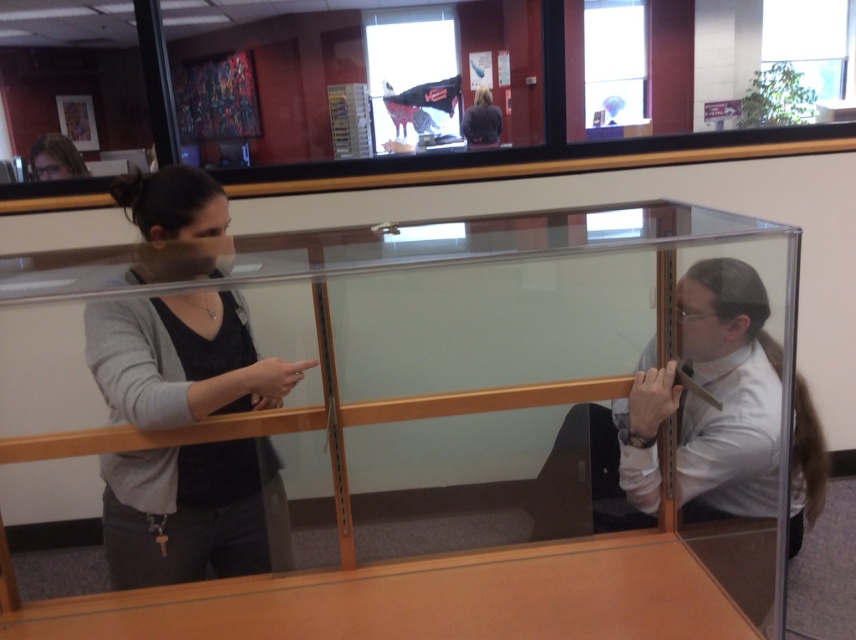
Does transparent glass box at center come in front of dark gray sweater at left?

Yes.

Which is below, transparent glass box at center or dark gray sweater at left?

Positioned lower is transparent glass box at center.

Does point (464, 413) come in front of point (254, 516)?

Yes, it is in front of point (254, 516).

You are a GUI agent. You are given a task and a screenshot of the screen. Output one action in this format:
    pyautogui.click(x=<x>, y=<y>)
    Task: Click on the transparent glass box at center
    This screenshot has height=640, width=856.
    Given the screenshot: What is the action you would take?
    pyautogui.click(x=421, y=384)

Is transparent glass box at center shorter than dark brown hair at upper center?

No.

Which is more to the left, transparent glass box at center or dark brown hair at upper center?

From the viewer's perspective, transparent glass box at center appears more on the left side.

Does point (753, 566) lie behind point (485, 109)?

That is False.

This screenshot has width=856, height=640. Find the location of `transparent glass box at center`. transparent glass box at center is located at coordinates (421, 384).

Based on the photo, who is lower down, transparent glass box at center or matte black hair at upper left?

Positioned lower is transparent glass box at center.

The height and width of the screenshot is (640, 856). What do you see at coordinates (421, 384) in the screenshot?
I see `transparent glass box at center` at bounding box center [421, 384].

Where is `transparent glass box at center`? The image size is (856, 640). transparent glass box at center is located at coordinates (421, 384).